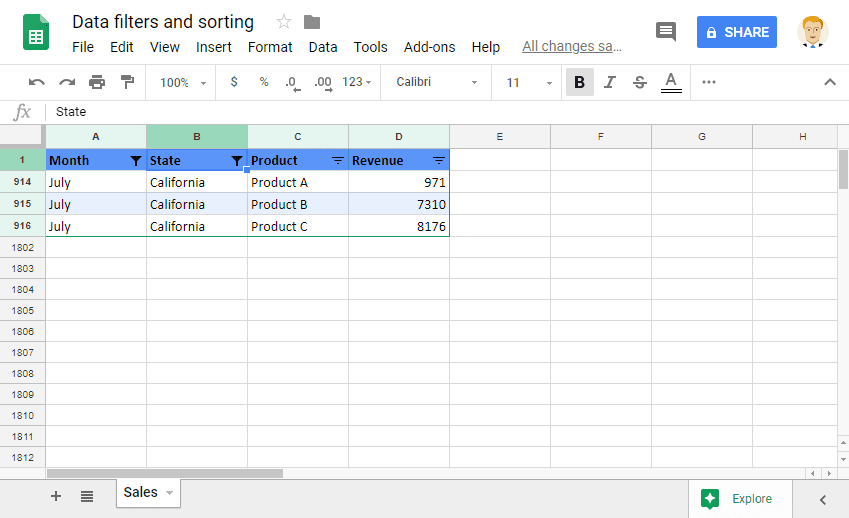
Find the location of a particular element. The image size is (849, 518). column is located at coordinates (96, 136), (198, 133), (295, 136), (400, 132), (504, 136), (596, 138), (694, 135), (791, 136).